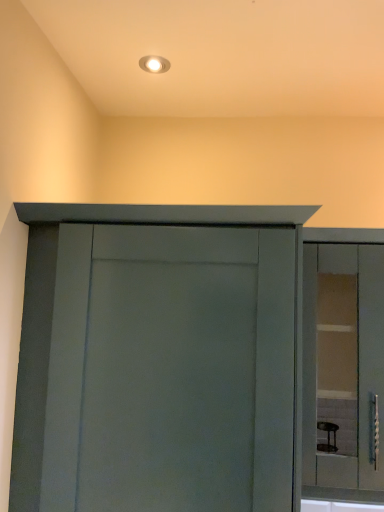
Question: From a real-world perspective, is matte gray cupboard at center above or below clear glass cabinet at right?

Choices:
 (A) above
 (B) below

Answer: (B)

Question: Looking at their shapes, would you say matte gray cupboard at center is wider or thinner than clear glass cabinet at right?

Choices:
 (A) wide
 (B) thin

Answer: (A)

Question: Is matte gray cupboard at center inside or outside of clear glass cabinet at right?

Choices:
 (A) outside
 (B) inside

Answer: (A)

Question: In terms of width, does clear glass cabinet at right look wider or thinner when compared to matte gray cupboard at center?

Choices:
 (A) wide
 (B) thin

Answer: (B)

Question: Would you say clear glass cabinet at right is inside or outside matte gray cupboard at center?

Choices:
 (A) inside
 (B) outside

Answer: (B)

Question: Considering the relative positions of clear glass cabinet at right and matte gray cupboard at center in the image provided, is clear glass cabinet at right to the left or to the right of matte gray cupboard at center?

Choices:
 (A) left
 (B) right

Answer: (B)

Question: From a real-world perspective, relative to matte gray cupboard at center, is clear glass cabinet at right vertically above or below?

Choices:
 (A) above
 (B) below

Answer: (A)